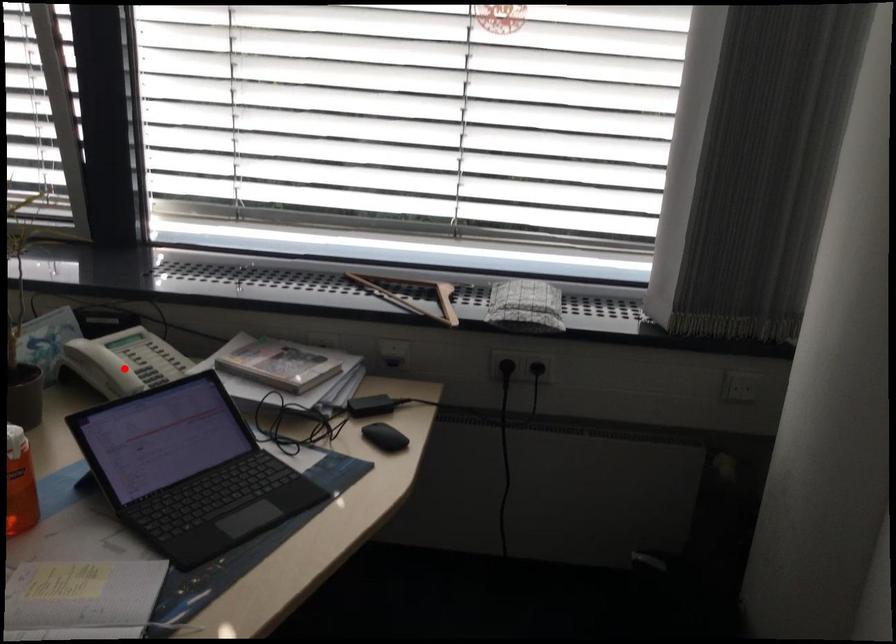
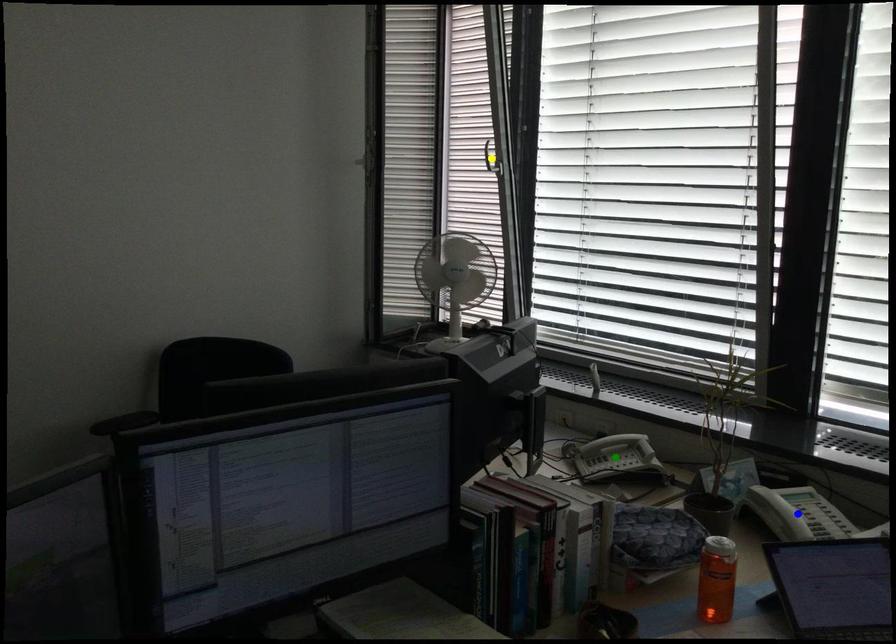
Question: I am providing you with two images of the same scene from different viewpoints. A red point is marked on the first image. You are given multiple points on the second image. Can you choose the point in image 2 that corresponds to the point in image 1?

Choices:
 (A) green point
 (B) yellow point
 (C) blue point

Answer: (C)